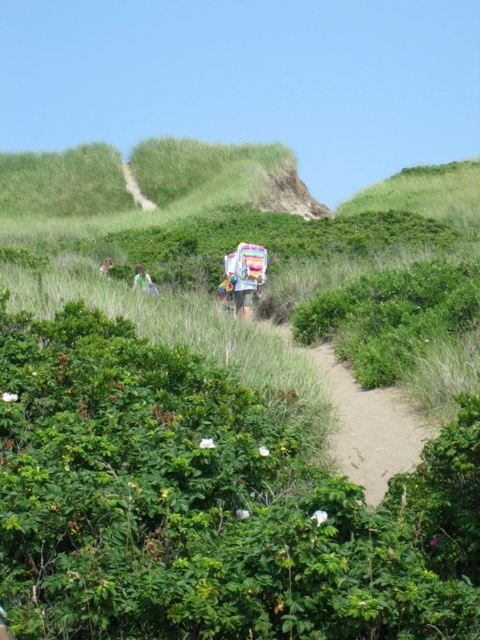
You are standing at the start of the path and see the brown sandy path at center and the light brown fabric at center. Which object is positioned to the right side of the other?

The brown sandy path at center is to the right of the light brown fabric at center.

In the scene shown: You are standing on the brown sandy path at center and want to pick up the green fabric bag at left. Which direction should you move to reach it?

The green fabric bag at left is farther from the viewer than the brown sandy path at center. To reach it, you should move forward towards the bag since it is located further ahead in the scene.